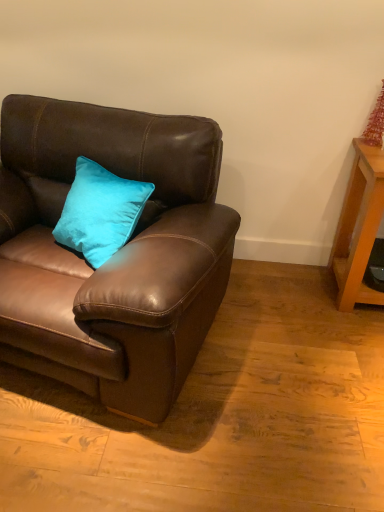
Identify the location of wooden table at right. The image size is (384, 512). (358, 227).

This screenshot has width=384, height=512. What do you see at coordinates (358, 227) in the screenshot?
I see `wooden table at right` at bounding box center [358, 227].

Locate an element on the screen. brown leather couch at left is located at coordinates (114, 255).

The height and width of the screenshot is (512, 384). What do you see at coordinates (114, 255) in the screenshot?
I see `brown leather couch at left` at bounding box center [114, 255].

The image size is (384, 512). I want to click on wooden table at right, so click(x=358, y=227).

Considering the relative positions of brown leather couch at left and wooden table at right in the image provided, is brown leather couch at left to the left of wooden table at right from the viewer's perspective?

Yes.

Who is more distant, brown leather couch at left or wooden table at right?

wooden table at right is further from the camera.

Is point (146, 350) closer to viewer compared to point (360, 163)?

Yes, it is in front of point (360, 163).

From the image's perspective, is brown leather couch at left under wooden table at right?

Yes.

From a real-world perspective, is brown leather couch at left under wooden table at right?

No, from a real-world perspective, brown leather couch at left is not under wooden table at right.

Considering the sizes of brown leather couch at left and wooden table at right in the image, is brown leather couch at left wider or thinner than wooden table at right?

brown leather couch at left is wider than wooden table at right.

Considering the sizes of objects brown leather couch at left and wooden table at right in the image provided, who is taller, brown leather couch at left or wooden table at right?

brown leather couch at left is taller.

Is brown leather couch at left smaller than wooden table at right?

Incorrect, brown leather couch at left is not smaller in size than wooden table at right.

Is wooden table at right completely or partially inside brown leather couch at left?

No, wooden table at right is not surrounded by brown leather couch at left.

Is brown leather couch at left positioned far away from wooden table at right?

Yes, brown leather couch at left is far from wooden table at right.

Does brown leather couch at left turn towards wooden table at right?

No, brown leather couch at left is not oriented towards wooden table at right.

Locate an element on the screen. Image resolution: width=384 pixels, height=512 pixels. studio couch below the wooden table at right (from the image's perspective) is located at coordinates (114, 255).

Considering the relative positions of wooden table at right and brown leather couch at left in the image provided, is wooden table at right to the left of brown leather couch at left from the viewer's perspective?

In fact, wooden table at right is to the right of brown leather couch at left.

Is the position of wooden table at right less distant than that of brown leather couch at left?

No, the depth of wooden table at right is greater than that of brown leather couch at left.

Which point is more distant from viewer, (344, 255) or (111, 298)?

The point (344, 255) is more distant.

From the image's perspective, would you say wooden table at right is positioned over brown leather couch at left?

Yes.

From a real-world perspective, which is physically below, wooden table at right or brown leather couch at left?

wooden table at right, from a real-world perspective.

In the scene shown: Looking at their sizes, would you say wooden table at right is wider or thinner than brown leather couch at left?

Clearly, wooden table at right has less width compared to brown leather couch at left.

From their relative heights in the image, would you say wooden table at right is taller or shorter than brown leather couch at left?

In the image, wooden table at right appears to be shorter than brown leather couch at left.

Is wooden table at right smaller than brown leather couch at left?

Correct, wooden table at right occupies less space than brown leather couch at left.

Is wooden table at right positioned beyond the bounds of brown leather couch at left?

Indeed, wooden table at right is completely outside brown leather couch at left.

Would you consider wooden table at right to be distant from brown leather couch at left?

Yes.

Is wooden table at right looking in the opposite direction of brown leather couch at left?

No, brown leather couch at left is not at the back of wooden table at right.

What are the coordinates of `studio couch in front of the wooden table at right` in the screenshot? It's located at (114, 255).

Where is `studio couch lying below the wooden table at right (from the image's perspective)`? studio couch lying below the wooden table at right (from the image's perspective) is located at coordinates pos(114,255).

I want to click on studio couch in front of the wooden table at right, so click(x=114, y=255).